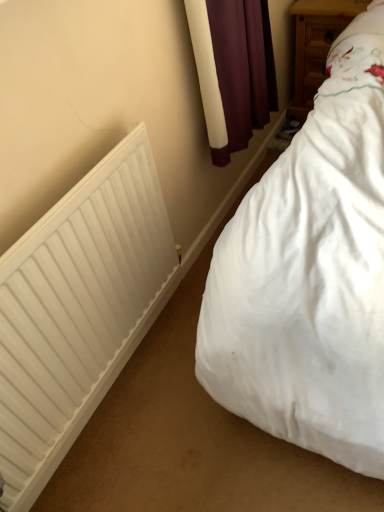
What do you see at coordinates (316, 45) in the screenshot? I see `white wood nightstand at upper right` at bounding box center [316, 45].

Locate an element on the screen. Image resolution: width=384 pixels, height=512 pixels. white wood nightstand at upper right is located at coordinates (316, 45).

Locate an element on the screen. The image size is (384, 512). white matte radiator at left is located at coordinates (78, 309).

What do you see at coordinates (78, 309) in the screenshot?
I see `white matte radiator at left` at bounding box center [78, 309].

Measure the distance between point [72,325] and camera.

Point [72,325] and camera are 1.08 meters apart from each other.

What are the coordinates of `white wood nightstand at upper right` in the screenshot? It's located at (316, 45).

Considering the positions of objects white wood nightstand at upper right and white matte radiator at left in the image provided, who is more to the left, white wood nightstand at upper right or white matte radiator at left?

white matte radiator at left.

Between white wood nightstand at upper right and white matte radiator at left, which one is positioned in front?

white matte radiator at left.

Which is closer, (366, 3) or (111, 383)?

The point (111, 383) is closer.

From the image's perspective, which one is positioned higher, white wood nightstand at upper right or white matte radiator at left?

white wood nightstand at upper right.

From a real-world perspective, who is located higher, white wood nightstand at upper right or white matte radiator at left?

From a 3D spatial view, white matte radiator at left is above.

Looking at their sizes, would you say white wood nightstand at upper right is wider or thinner than white matte radiator at left?

Considering their sizes, white wood nightstand at upper right looks broader than white matte radiator at left.

In terms of height, does white wood nightstand at upper right look taller or shorter compared to white matte radiator at left?

Considering their sizes, white wood nightstand at upper right has less height than white matte radiator at left.

Which of these two, white wood nightstand at upper right or white matte radiator at left, is bigger?

With larger size is white wood nightstand at upper right.

Is white wood nightstand at upper right inside or outside of white matte radiator at left?

white wood nightstand at upper right is outside white matte radiator at left.

Is white wood nightstand at upper right directly adjacent to white matte radiator at left?

No, white wood nightstand at upper right is not beside white matte radiator at left.

Is white wood nightstand at upper right aimed at white matte radiator at left?

Yes, white wood nightstand at upper right is aimed at white matte radiator at left.

What's the angular difference between white wood nightstand at upper right and white matte radiator at left's facing directions?

The angle between the facing direction of white wood nightstand at upper right and the facing direction of white matte radiator at left is 90.3 degrees.

Find the location of a particular element. The height and width of the screenshot is (512, 384). furniture below the white matte radiator at left (from a real-world perspective) is located at coordinates (316, 45).

Which object is positioned more to the right, white matte radiator at left or white wood nightstand at upper right?

Positioned to the right is white wood nightstand at upper right.

Is the depth of white matte radiator at left greater than that of white wood nightstand at upper right?

No, it is in front of white wood nightstand at upper right.

Between point (107, 372) and point (318, 86), which one is positioned in front?

The point (107, 372) is closer to the camera.

From the image's perspective, is white matte radiator at left on top of white wood nightstand at upper right?

Actually, white matte radiator at left appears below white wood nightstand at upper right in the image.

From a real-world perspective, is white matte radiator at left physically located above or below white wood nightstand at upper right?

white matte radiator at left is above white wood nightstand at upper right.

Is white matte radiator at left wider than white wood nightstand at upper right?

No.

Considering the sizes of white matte radiator at left and white wood nightstand at upper right in the image, is white matte radiator at left taller or shorter than white wood nightstand at upper right?

Clearly, white matte radiator at left is taller compared to white wood nightstand at upper right.

Can you confirm if white matte radiator at left is smaller than white wood nightstand at upper right?

Correct, white matte radiator at left occupies less space than white wood nightstand at upper right.

Is white matte radiator at left spatially inside white wood nightstand at upper right, or outside of it?

white matte radiator at left is located beyond the bounds of white wood nightstand at upper right.

Is white matte radiator at left next to white wood nightstand at upper right and touching it?

They are not placed beside each other.

Is white matte radiator at left turned away from white wood nightstand at upper right?

That's not correct — white matte radiator at left is not looking away from white wood nightstand at upper right.

The width and height of the screenshot is (384, 512). I want to click on radiator above the white wood nightstand at upper right (from a real-world perspective), so click(78, 309).

Find the location of `radiator above the white wood nightstand at upper right (from a real-world perspective)`. radiator above the white wood nightstand at upper right (from a real-world perspective) is located at coordinates (78, 309).

I want to click on furniture below the white matte radiator at left (from a real-world perspective), so click(x=316, y=45).